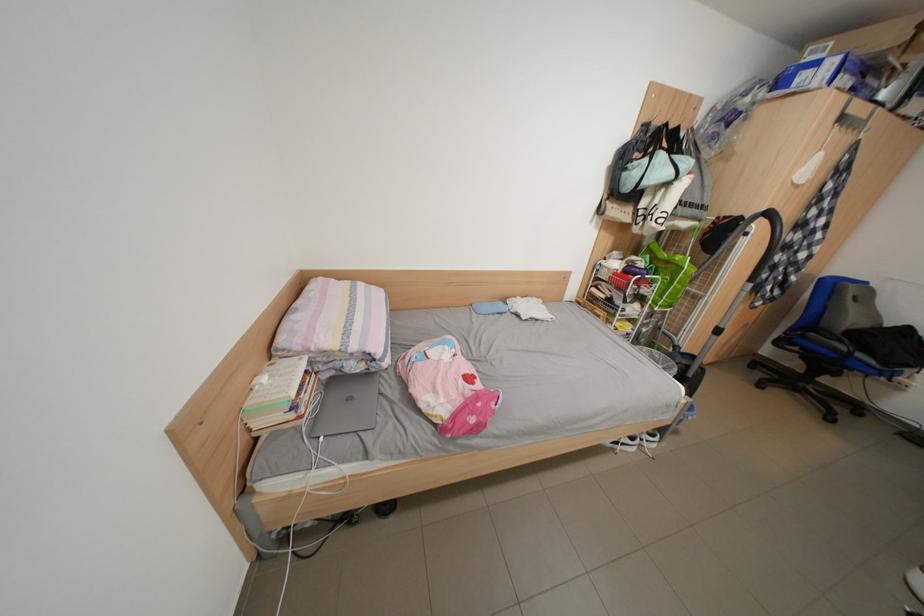
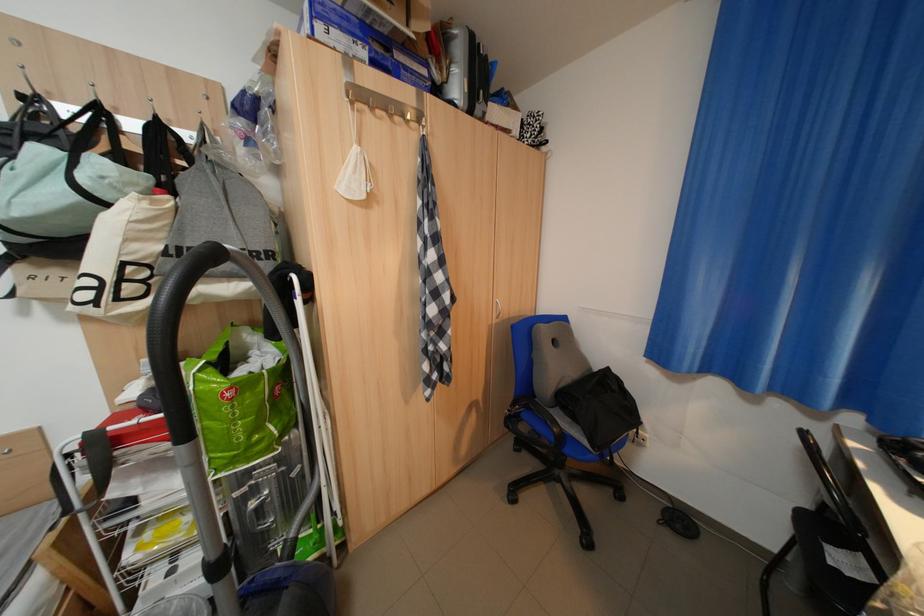
The images are taken continuously from a first-person perspective. In which direction are you moving?

The movement direction of the cameraman is right, forward.